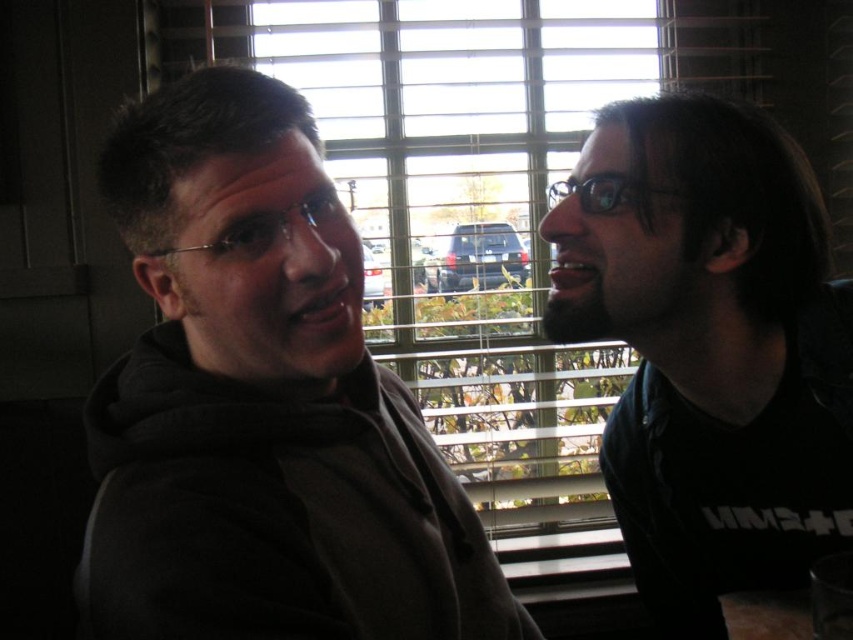
Question: Is dark gray hoodie at left positioned behind black matte shirt at right?

Choices:
 (A) no
 (B) yes

Answer: (A)

Question: Is dark gray hoodie at left to the left of black matte shirt at right from the viewer's perspective?

Choices:
 (A) no
 (B) yes

Answer: (B)

Question: From the image, what is the correct spatial relationship of dark gray hoodie at left in relation to black matte shirt at right?

Choices:
 (A) left
 (B) right

Answer: (A)

Question: Which object appears closest to the camera in this image?

Choices:
 (A) black matte shirt at right
 (B) dark gray hoodie at left

Answer: (B)